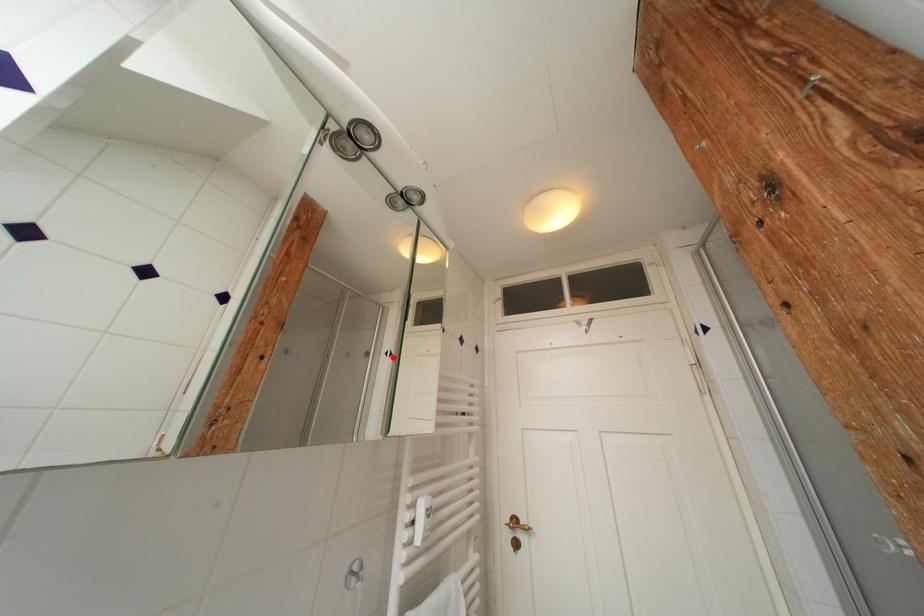
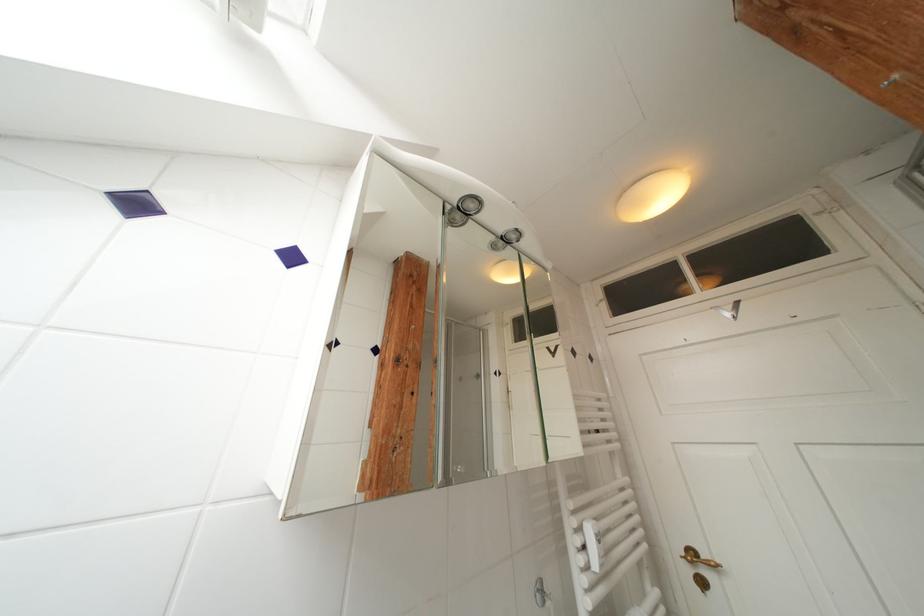
The point at the highlighted location is marked in the first image. Where is the corresponding point in the second image?

(502, 377)